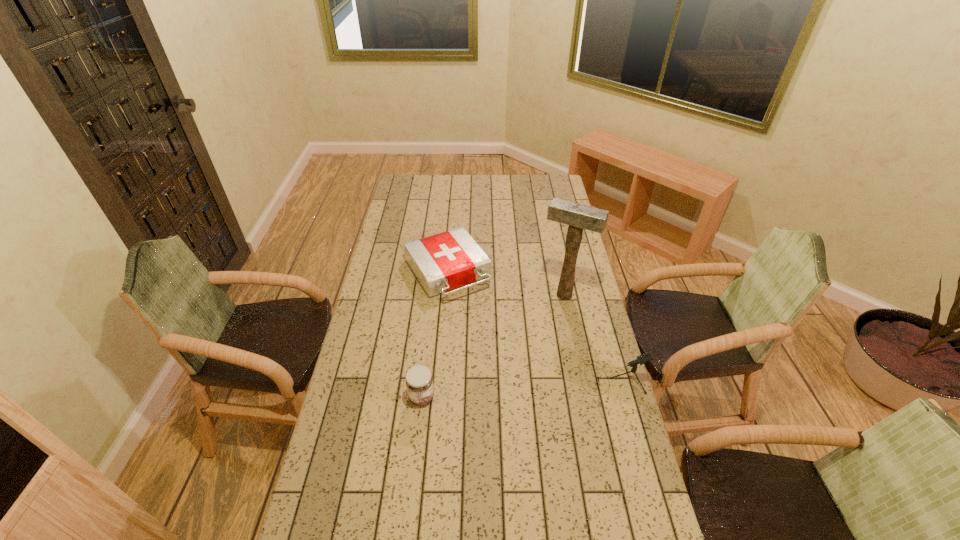
Where is `vacant point located on the front side of the shortest object`? The width and height of the screenshot is (960, 540). vacant point located on the front side of the shortest object is located at coordinates 514,370.

This screenshot has height=540, width=960. Identify the location of vacant space located 0.050m on the striking surface of the mallet. (551, 314).

Locate an element on the screen. free point located 0.310m on the striking surface of the mallet is located at coordinates (527, 363).

Locate an element on the screen. vacant space located on the striking surface of the mallet is located at coordinates (550, 316).

Locate an element on the screen. Image resolution: width=960 pixels, height=540 pixels. object located at the left edge is located at coordinates (445, 261).

Locate an element on the screen. The height and width of the screenshot is (540, 960). microphone present at the right edge is located at coordinates (646, 357).

Locate an element on the screen. The width and height of the screenshot is (960, 540). mallet that is at the right edge is located at coordinates (578, 217).

Image resolution: width=960 pixels, height=540 pixels. Identify the location of vacant area at the far edge. (485, 195).

Locate an element on the screen. This screenshot has height=540, width=960. free region at the near edge of the desktop is located at coordinates (402, 528).

You are a GUI agent. You are given a task and a screenshot of the screen. Output one action in this format:
    pyautogui.click(x=<x>, y=<y>)
    Task: Click on the free point at the left edge
    The image size is (960, 540).
    Given the screenshot: What is the action you would take?
    pyautogui.click(x=342, y=496)